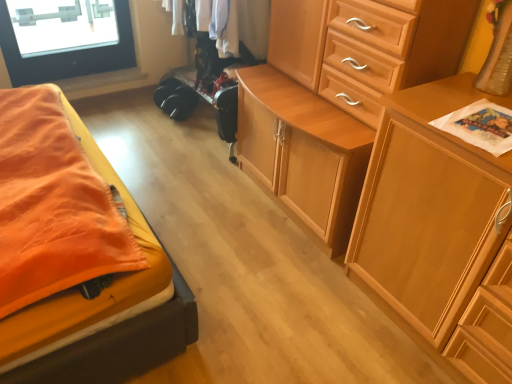
Question: Is wooden cabinet at center, arranged as the 2th chest of drawers when viewed from the left, at the back of black fabric clothing at center?

Choices:
 (A) yes
 (B) no

Answer: (B)

Question: Considering the relative sizes of black fabric clothing at center and wooden cabinet at center, arranged as the 2th chest of drawers when viewed from the left, in the image provided, is black fabric clothing at center wider than wooden cabinet at center, arranged as the 2th chest of drawers when viewed from the left,?

Choices:
 (A) yes
 (B) no

Answer: (B)

Question: Does black fabric clothing at center have a smaller size compared to wooden cabinet at center, which appears as the first chest of drawers when viewed from the right?

Choices:
 (A) yes
 (B) no

Answer: (A)

Question: Is black fabric clothing at center positioned in front of wooden cabinet at center, arranged as the 2th chest of drawers when viewed from the left?

Choices:
 (A) yes
 (B) no

Answer: (B)

Question: Does black fabric clothing at center lie behind wooden cabinet at center, which appears as the first chest of drawers when viewed from the right?

Choices:
 (A) no
 (B) yes

Answer: (B)

Question: From a real-world perspective, is wooden cabinet at center, which appears as the first chest of drawers when viewed from the right, positioned above or below wooden cabinet at center, positioned as the 2th chest of drawers in right-to-left order?

Choices:
 (A) above
 (B) below

Answer: (B)

Question: In terms of size, does wooden cabinet at center, which appears as the first chest of drawers when viewed from the right, appear bigger or smaller than wooden cabinet at center, acting as the 1th chest of drawers starting from the left?

Choices:
 (A) small
 (B) big

Answer: (A)

Question: Is point (415, 91) closer or farther from the camera than point (239, 147)?

Choices:
 (A) closer
 (B) farther

Answer: (A)

Question: From the image's perspective, is wooden cabinet at center, which appears as the first chest of drawers when viewed from the right, above or below wooden cabinet at center, acting as the 1th chest of drawers starting from the left?

Choices:
 (A) below
 (B) above

Answer: (A)

Question: Is point (209, 44) closer or farther from the camera than point (433, 41)?

Choices:
 (A) closer
 (B) farther

Answer: (B)

Question: In the image, is black fabric clothing at center positioned in front of or behind wooden cabinet at center, acting as the 1th chest of drawers starting from the left?

Choices:
 (A) front
 (B) behind

Answer: (B)

Question: Considering the positions of black fabric clothing at center and wooden cabinet at center, acting as the 1th chest of drawers starting from the left, in the image, is black fabric clothing at center taller or shorter than wooden cabinet at center, acting as the 1th chest of drawers starting from the left,?

Choices:
 (A) tall
 (B) short

Answer: (B)

Question: In terms of width, does black fabric clothing at center look wider or thinner when compared to wooden cabinet at center, positioned as the 2th chest of drawers in right-to-left order?

Choices:
 (A) wide
 (B) thin

Answer: (B)

Question: In the image, is wooden cabinet at center, positioned as the 2th chest of drawers in right-to-left order, on the left side or the right side of wooden cabinet at center, which appears as the first chest of drawers when viewed from the right?

Choices:
 (A) left
 (B) right

Answer: (A)

Question: In terms of width, does wooden cabinet at center, acting as the 1th chest of drawers starting from the left, look wider or thinner when compared to wooden cabinet at center, arranged as the 2th chest of drawers when viewed from the left?

Choices:
 (A) wide
 (B) thin

Answer: (A)